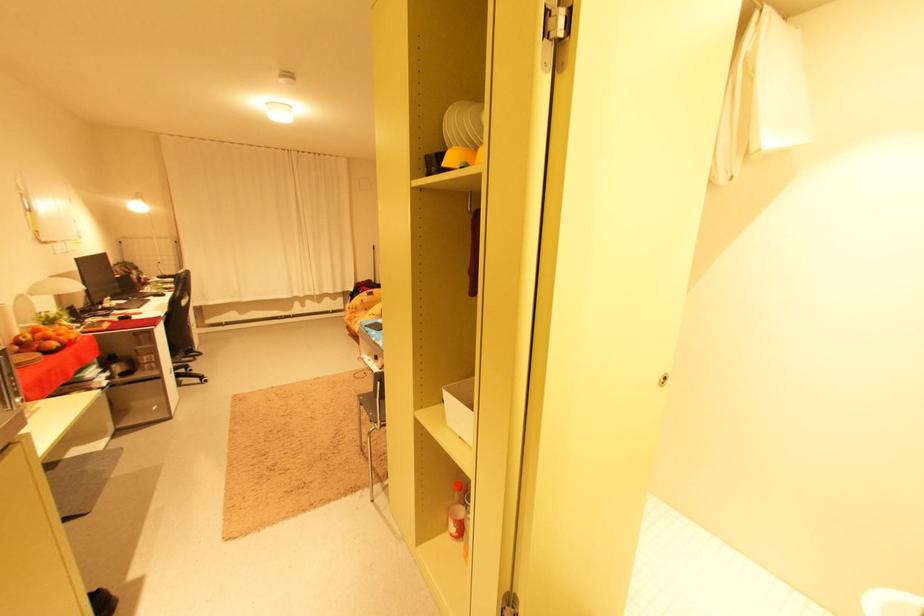
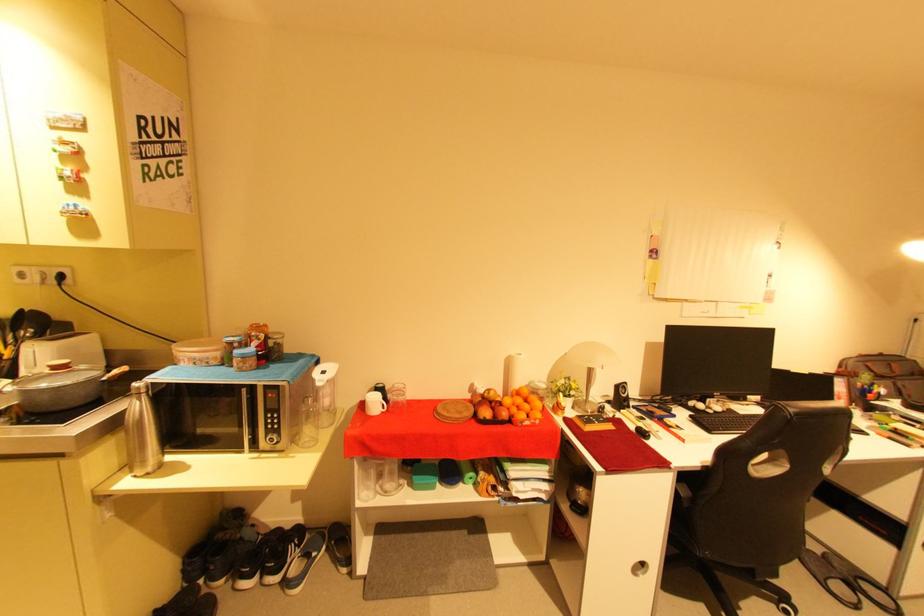
Where in the second image is the point corresponding to the highlighted location from the first image?

(503, 416)